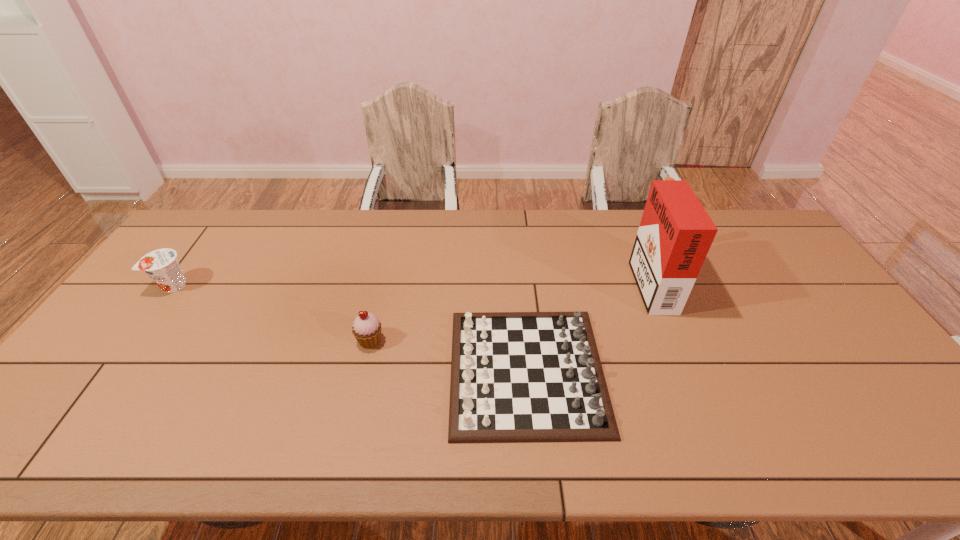
The height and width of the screenshot is (540, 960). I want to click on unoccupied area between the chessboard and the cupcake, so click(x=448, y=355).

Find the location of a particular element. Image resolution: width=960 pixels, height=540 pixels. free space between the shortest object and the yogurt is located at coordinates (350, 328).

I want to click on vacant area that lies between the second object from left to right and the chessboard, so click(448, 355).

Locate an element on the screen. Image resolution: width=960 pixels, height=540 pixels. free space between the rightmost object and the leftmost object is located at coordinates (412, 284).

Find the location of a particular element. free space between the shortest object and the cupcake is located at coordinates (448, 355).

Where is `vacant point located between the yogurt and the chessboard`? The width and height of the screenshot is (960, 540). vacant point located between the yogurt and the chessboard is located at coordinates (350, 328).

Where is `vacant point located between the third object from left to right and the cupcake`? vacant point located between the third object from left to right and the cupcake is located at coordinates (448, 355).

Locate an element on the screen. The image size is (960, 540). blank region between the cupcake and the leftmost object is located at coordinates (272, 313).

Locate which object ranks second in proximity to the leftmost object. Please provide its 2D coordinates. Your answer should be formatted as a tuple, i.e. [(x, y)], where the tuple contains the x and y coordinates of a point satisfying the conditions above.

[(515, 376)]

Locate which object is the second closest to the chessboard. Please provide its 2D coordinates. Your answer should be formatted as a tuple, i.e. [(x, y)], where the tuple contains the x and y coordinates of a point satisfying the conditions above.

[(366, 329)]